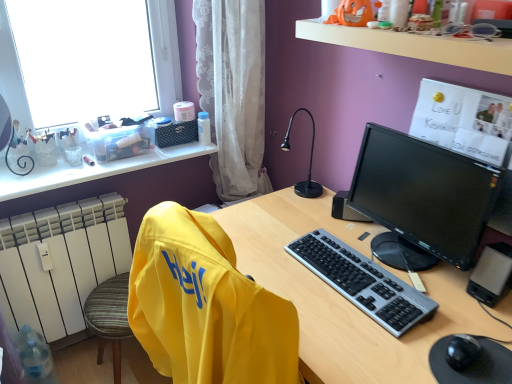
The height and width of the screenshot is (384, 512). Find the location of `free spot to the left of black plastic keyboard at center`. free spot to the left of black plastic keyboard at center is located at coordinates (279, 263).